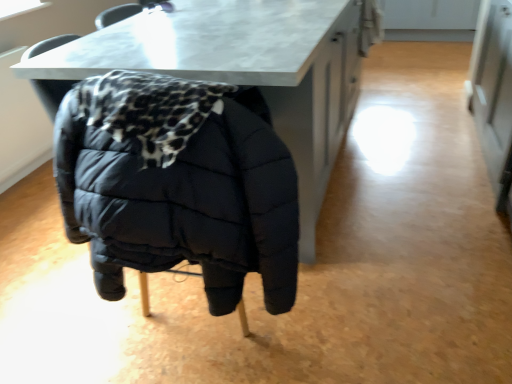
Question: Does point (202, 223) appear closer or farther from the camera than point (241, 59)?

Choices:
 (A) closer
 (B) farther

Answer: (A)

Question: Relative to matte white marble table at center, is matte black puffer jacket at center in front or behind?

Choices:
 (A) front
 (B) behind

Answer: (A)

Question: From a real-world perspective, is matte black puffer jacket at center positioned above or below matte white marble table at center?

Choices:
 (A) above
 (B) below

Answer: (A)

Question: From a real-world perspective, relative to matte black puffer jacket at center, is matte white marble table at center vertically above or below?

Choices:
 (A) below
 (B) above

Answer: (A)

Question: Looking at the image, does matte white marble table at center seem bigger or smaller compared to matte black puffer jacket at center?

Choices:
 (A) big
 (B) small

Answer: (A)

Question: Considering the positions of matte white marble table at center and matte black puffer jacket at center in the image, is matte white marble table at center taller or shorter than matte black puffer jacket at center?

Choices:
 (A) tall
 (B) short

Answer: (B)

Question: Is matte white marble table at center to the left or to the right of matte black puffer jacket at center in the image?

Choices:
 (A) left
 (B) right

Answer: (B)